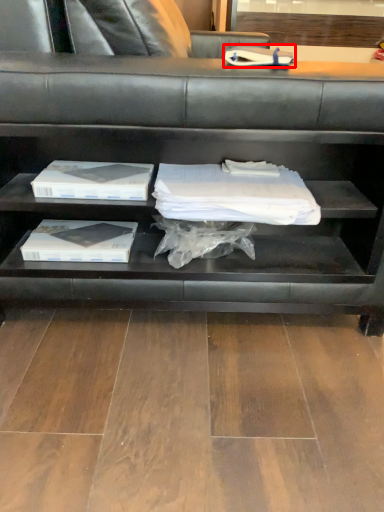
Question: In this image, where is book (annotated by the red box) located relative to shelf?

Choices:
 (A) left
 (B) right

Answer: (B)